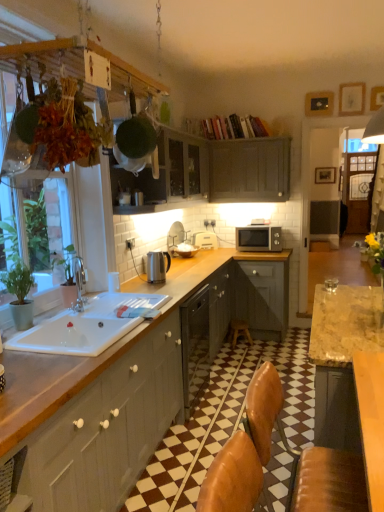
I want to click on free spot above matte gray cabinet at left, which is the 3th cabinetry in back-to-front order (from a real-world perspective), so click(x=81, y=337).